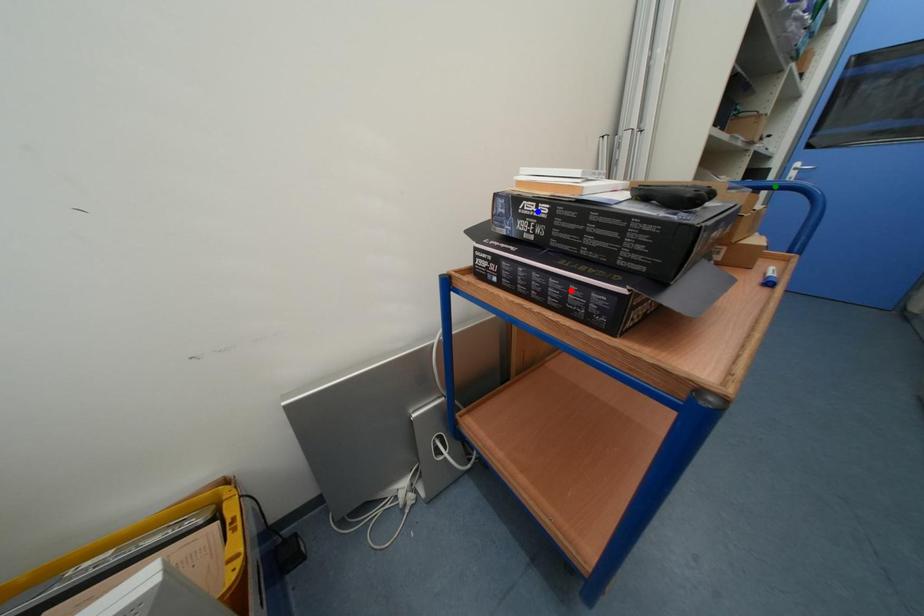
Order these from nearest to farthest:
red point
green point
blue point

red point, blue point, green point